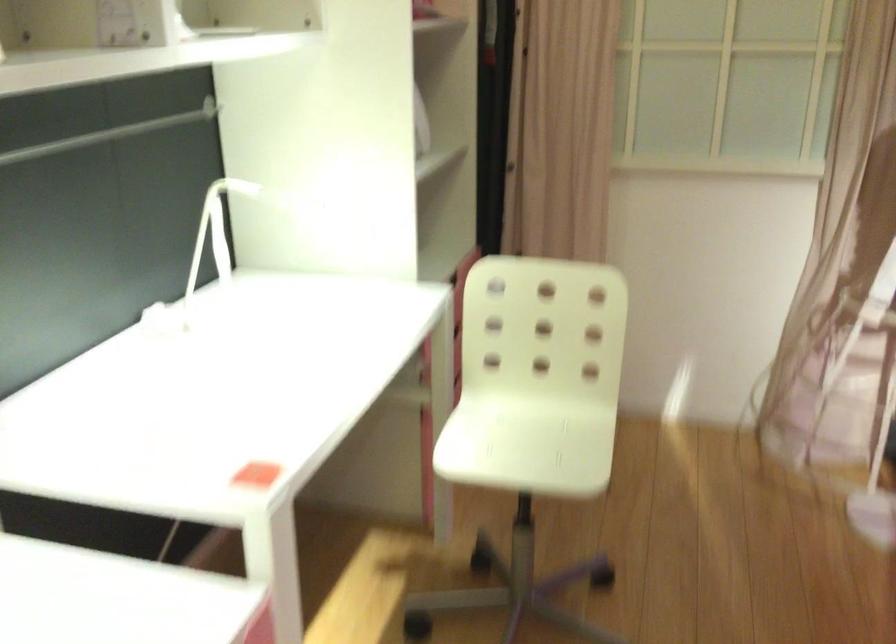
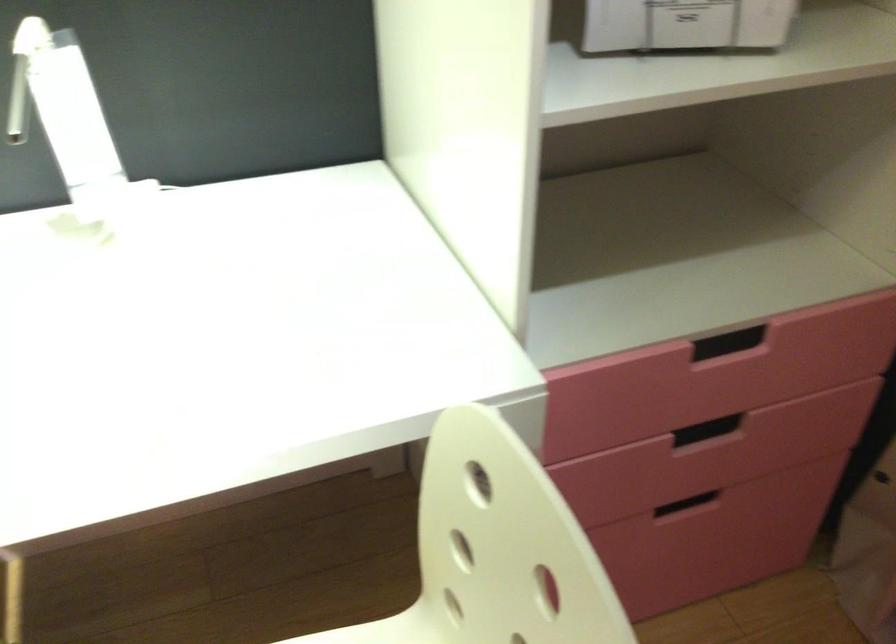
Locate, in the second image, the point that corresponds to point (409, 147) in the first image.

(685, 24)